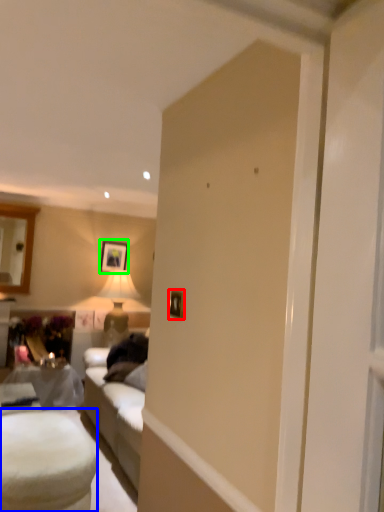
Question: Which is nearer to the picture frame (highlighted by a red box)? table (highlighted by a blue box) or picture frame (highlighted by a green box).

Choices:
 (A) table
 (B) picture frame

Answer: (A)